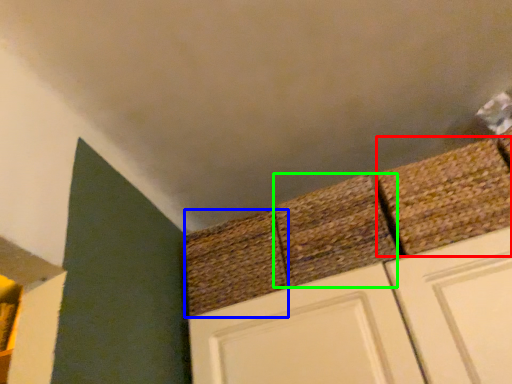
Question: Which object is positioned farthest from brick (highlighted by a red box)? Select from brick (highlighted by a blue box) and brick (highlighted by a green box).

Choices:
 (A) brick
 (B) brick

Answer: (A)